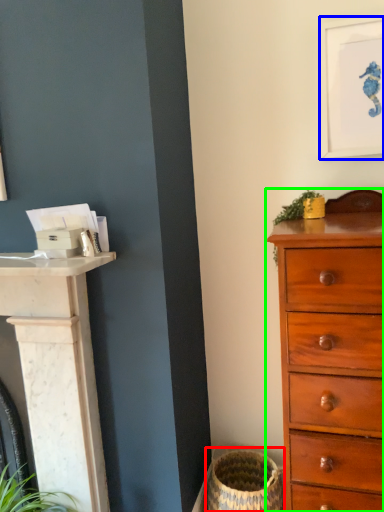
Question: Based on their relative distances, which object is farther from basket container (highlighted by a red box)? Choose from picture frame (highlighted by a blue box) and chest of drawers (highlighted by a green box).

Choices:
 (A) picture frame
 (B) chest of drawers

Answer: (A)